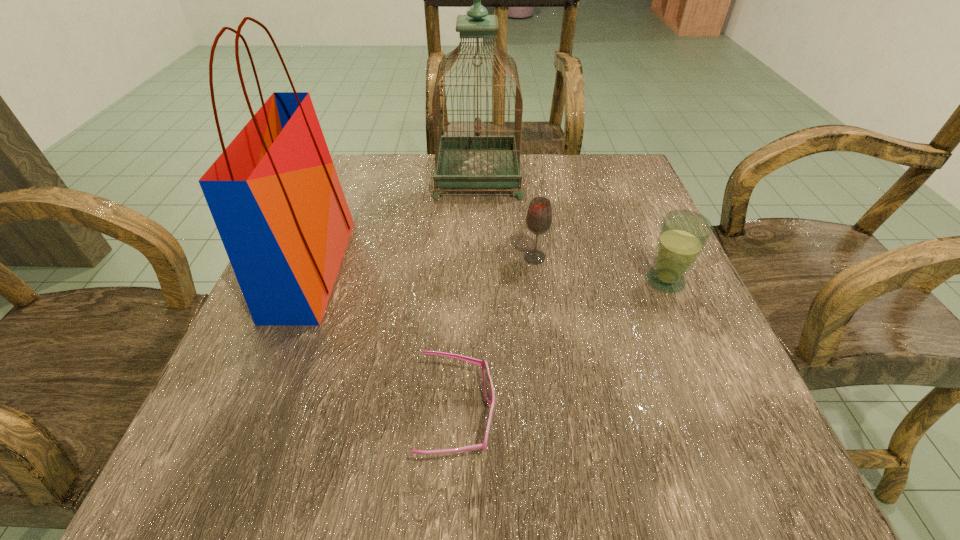
Identify the location of vacant area that lies between the shopping bag and the nearest object. The height and width of the screenshot is (540, 960). (384, 342).

This screenshot has height=540, width=960. In order to click on the second closest object to the birdcage in this screenshot , I will do `click(274, 194)`.

Locate which object is the third closest to the left glass drink container. Please provide its 2D coordinates. Your answer should be formatted as a tuple, i.e. [(x, y)], where the tuple contains the x and y coordinates of a point satisfying the conditions above.

[(488, 386)]

Locate an element on the screen. The image size is (960, 540). vacant space that satisfies the following two spatial constraints: 1. at the door of the rightmost object; 2. on the left side of the farthest object is located at coordinates (477, 281).

You are a GUI agent. You are given a task and a screenshot of the screen. Output one action in this format:
    pyautogui.click(x=<x>, y=<y>)
    Task: Click on the free space that satisfies the following two spatial constraints: 1. on the handle side of the leftmost object; 2. on the back side of the rightmost object
    Image resolution: width=960 pixels, height=540 pixels.
    Given the screenshot: What is the action you would take?
    pyautogui.click(x=306, y=281)

This screenshot has width=960, height=540. I want to click on free spot that satisfies the following two spatial constraints: 1. on the front side of the farther glass drink container; 2. on the left side of the rightmost object, so click(x=538, y=281).

Image resolution: width=960 pixels, height=540 pixels. What are the coordinates of `free location that satisfies the following two spatial constraints: 1. on the front side of the left glass drink container; 2. on the front-facing side of the sunglasses` in the screenshot? It's located at (556, 416).

Identify the location of free point that satisfies the following two spatial constraints: 1. on the front side of the left glass drink container; 2. on the handle side of the leftmost object. The width and height of the screenshot is (960, 540). (537, 268).

The image size is (960, 540). What are the coordinates of `free space that satisfies the following two spatial constraints: 1. at the door of the nearer glass drink container; 2. on the left side of the birdcage` in the screenshot? It's located at (477, 281).